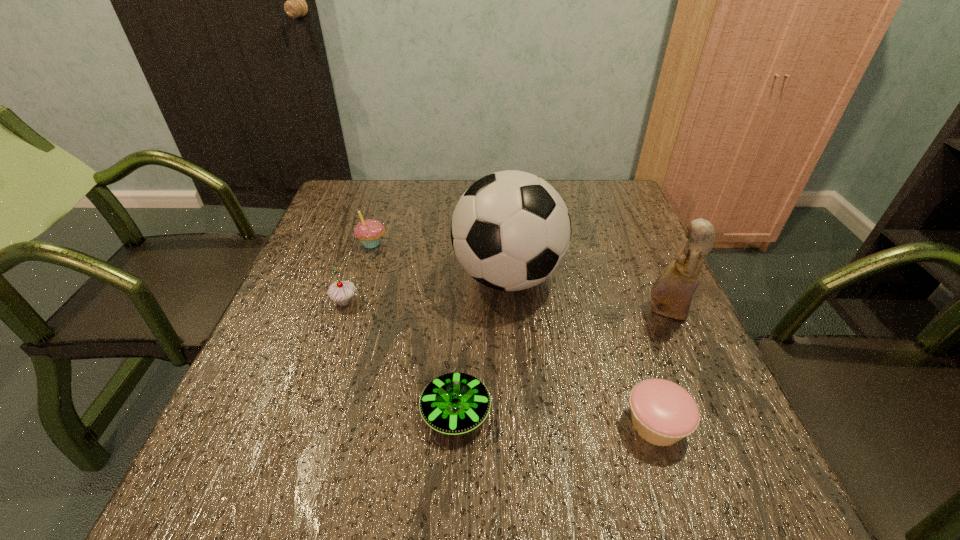
Identify the location of vacant space at the right edge of the desktop. Image resolution: width=960 pixels, height=540 pixels. (678, 333).

The width and height of the screenshot is (960, 540). I want to click on free space at the far left corner of the desktop, so click(376, 180).

This screenshot has height=540, width=960. In the image, there is a desktop. Find the location of `free region at the near left corner`. free region at the near left corner is located at coordinates (285, 470).

Identify the location of blank space at the far right corner of the desktop. This screenshot has width=960, height=540. click(x=598, y=199).

Where is `free region at the near right corner of the desktop`? The width and height of the screenshot is (960, 540). free region at the near right corner of the desktop is located at coordinates (765, 477).

Where is `empty location between the rightmost cupcake and the soccer ball`? The width and height of the screenshot is (960, 540). empty location between the rightmost cupcake and the soccer ball is located at coordinates (582, 350).

At what (x,y) coordinates should I click in order to perform the action: click on unoccupied area between the shortest cupcake and the second shortest cupcake. Please return your answer as a coordinate pair (x, y). The width and height of the screenshot is (960, 540). Looking at the image, I should click on (500, 363).

The height and width of the screenshot is (540, 960). In order to click on empty location between the farthest cupcake and the rightmost cupcake in this screenshot , I will do `click(514, 334)`.

You are a GUI agent. You are given a task and a screenshot of the screen. Output one action in this format:
    pyautogui.click(x=<x>, y=<y>)
    Task: Click on the vacant area between the farthest cupcake and the saucer
    The image size is (960, 540).
    Given the screenshot: What is the action you would take?
    pyautogui.click(x=414, y=328)

You are a GUI agent. You are given a task and a screenshot of the screen. Output one action in this format:
    pyautogui.click(x=<x>, y=<y>)
    Task: Click on the vacant area that lies between the nearest cupcake and the second farthest cupcake
    This screenshot has height=540, width=960.
    Given the screenshot: What is the action you would take?
    pyautogui.click(x=500, y=363)